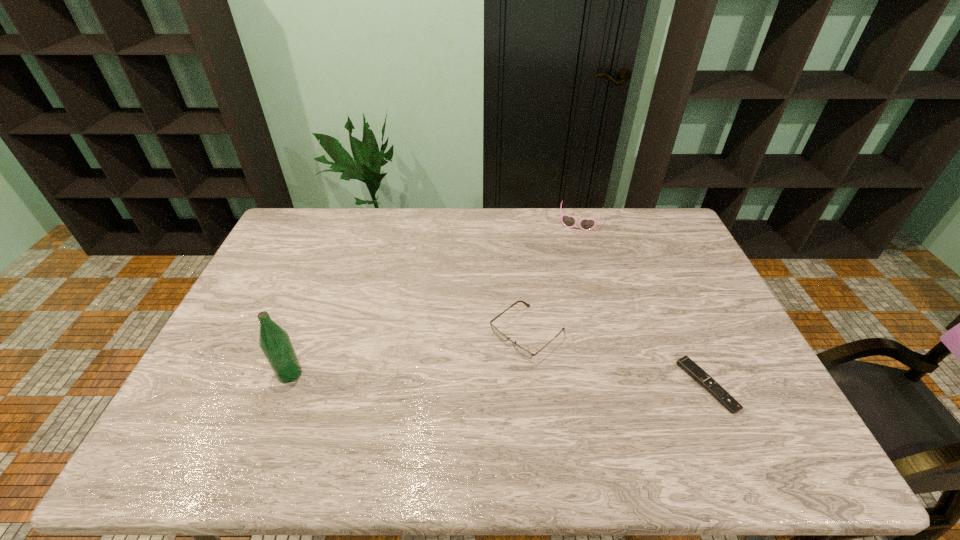
Identify the location of vacant area between the second object from right to left and the bottle. The image size is (960, 540). (435, 298).

At what (x,y) coordinates should I click in order to perform the action: click on free point between the bottle and the third shortest object. Please return your answer as a coordinate pair (x, y). The height and width of the screenshot is (540, 960). Looking at the image, I should click on (435, 298).

Locate an element on the screen. vacant space in between the bottle and the shortest object is located at coordinates pos(498,380).

Where is `free space between the rightmost object and the spectacles`? The width and height of the screenshot is (960, 540). free space between the rightmost object and the spectacles is located at coordinates (617, 359).

Where is `blank region between the sunglasses and the second shortest object`? This screenshot has width=960, height=540. blank region between the sunglasses and the second shortest object is located at coordinates (554, 278).

Identify which object is located as the second nearest to the tallest object. Please provide its 2D coordinates. Your answer should be formatted as a tuple, i.e. [(x, y)], where the tuple contains the x and y coordinates of a point satisfying the conditions above.

[(585, 224)]

Identify the location of object that is the second closest to the rightmost object. (585, 224).

You are a GUI agent. You are given a task and a screenshot of the screen. Output one action in this format:
    pyautogui.click(x=<x>, y=<y>)
    Task: Click on the free space that satisfies the following two spatial constraints: 1. on the back side of the leftmost object; 2. on the left side of the third object from right to left
    This screenshot has height=540, width=960.
    Given the screenshot: What is the action you would take?
    pyautogui.click(x=305, y=333)